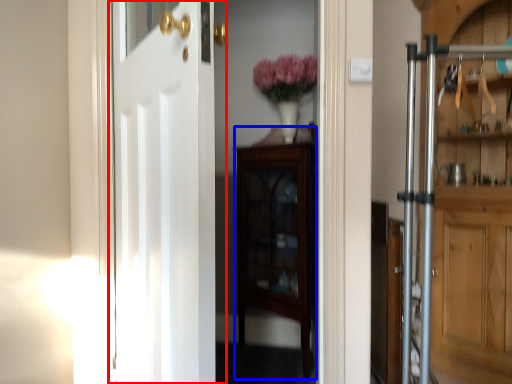
Question: Which of the following is the farthest to the observer, door (highlighted by a red box) or cabinetry (highlighted by a blue box)?

Choices:
 (A) door
 (B) cabinetry

Answer: (B)